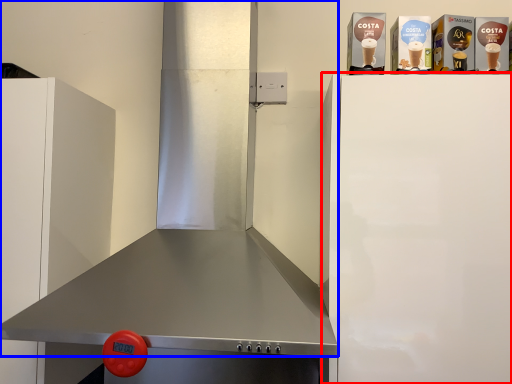
Question: Which object is closer to the camera taking this photo, appliance (highlighted by a red box) or exhaust hood (highlighted by a blue box)?

Choices:
 (A) appliance
 (B) exhaust hood

Answer: (B)